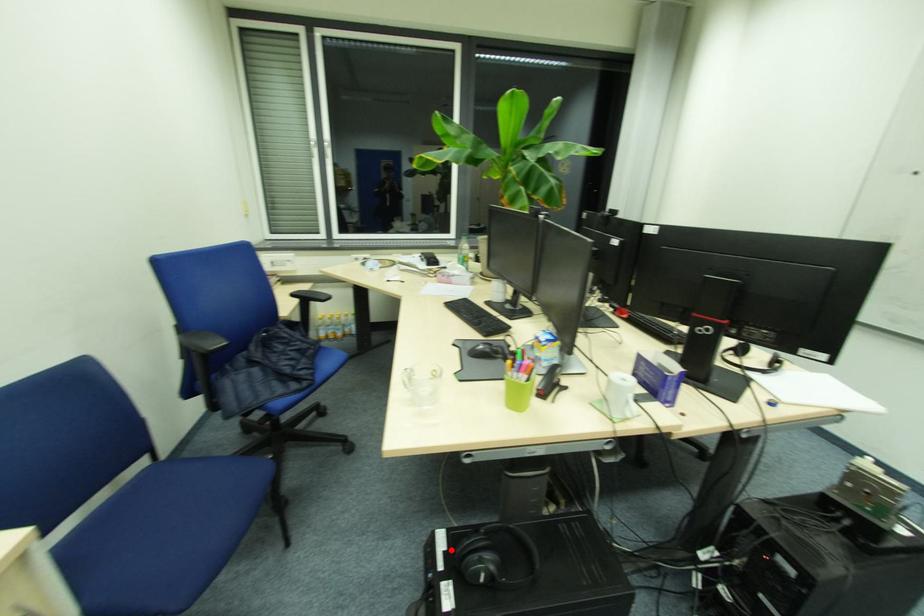
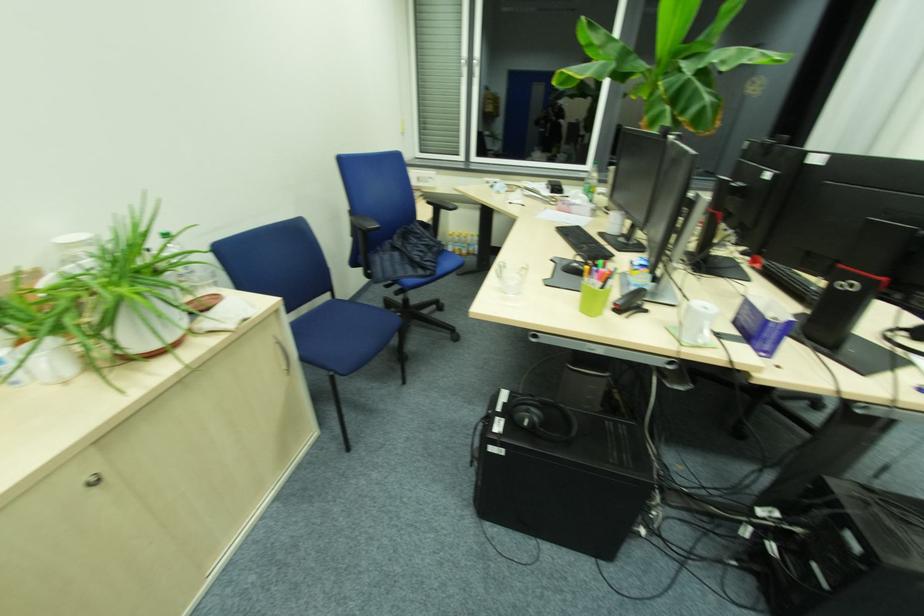
The point at the highlighted location is marked in the first image. Where is the corresponding point in the second image?

(511, 403)